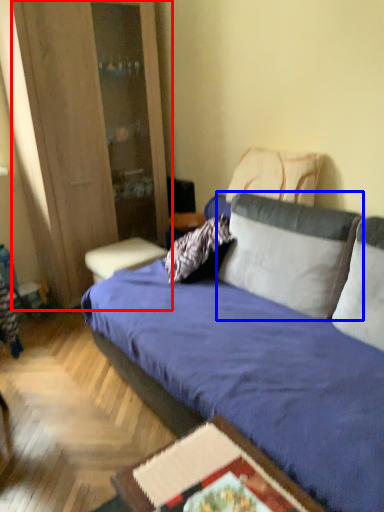
Question: Which object is closer to the camera taking this photo, dresser (highlighted by a red box) or pillow (highlighted by a blue box)?

Choices:
 (A) dresser
 (B) pillow

Answer: (B)